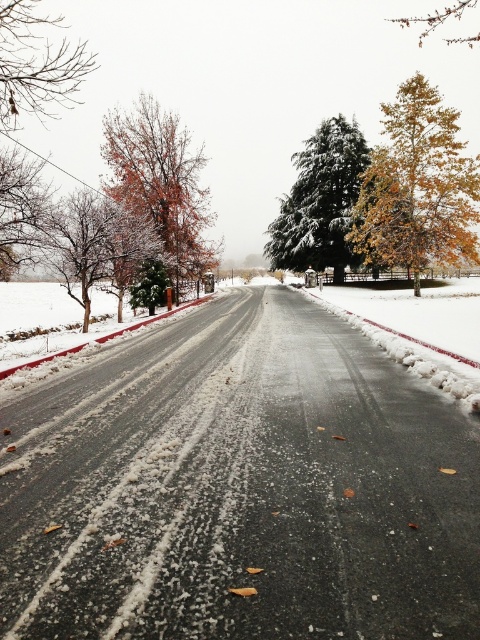
Between golden-brown textured tree at upper right and bare branches at upper left, which one is positioned higher?

Positioned higher is bare branches at upper left.

Can you confirm if golden-brown textured tree at upper right is positioned below bare branches at upper left?

Yes.

You are a GUI agent. You are given a task and a screenshot of the screen. Output one action in this format:
    pyautogui.click(x=<x>, y=<y>)
    Task: Click on the golden-brown textured tree at upper right
    This screenshot has height=640, width=480.
    Given the screenshot: What is the action you would take?
    pyautogui.click(x=418, y=188)

Locate an element on the screen. The height and width of the screenshot is (640, 480). golden-brown textured tree at upper right is located at coordinates (418, 188).

Looking at this image, does snow-covered evergreen at center have a greater width compared to bare branches at left?

No.

Does snow-covered evergreen at center appear under bare branches at left?

No.

Is point (327, 145) positioned in front of point (21, 252)?

No, it is not.

Find the location of a particular element. snow-covered evergreen at center is located at coordinates (321, 202).

Can you confirm if orange-brown textured tree at left is taller than bare branches at upper left?

In fact, orange-brown textured tree at left may be shorter than bare branches at upper left.

Which is above, orange-brown textured tree at left or bare branches at upper left?

bare branches at upper left is higher up.

This screenshot has height=640, width=480. In order to click on orange-brown textured tree at left in this screenshot , I will do `click(160, 180)`.